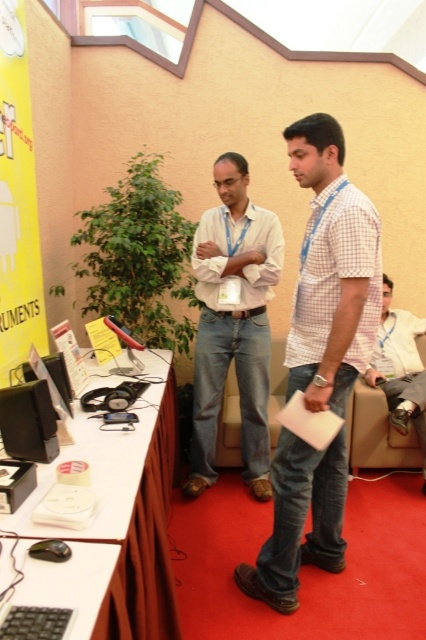
Question: From the image, what is the correct spatial relationship of light beige shirt at center in relation to yellow paper at upper left?

Choices:
 (A) below
 (B) above

Answer: (A)

Question: Which object appears closest to the camera in this image?

Choices:
 (A) yellow paper at upper left
 (B) white glossy table at lower left

Answer: (B)

Question: Is white glossy table at lower left closer to the viewer compared to light beige shirt at center?

Choices:
 (A) yes
 (B) no

Answer: (A)

Question: Based on their relative distances, which object is farther from the white glossy table at lower left?

Choices:
 (A) black plastic keyboard at lower left
 (B) white checkered shirt at center
 (C) yellow paper at upper left

Answer: (C)

Question: Which of the following is the farthest from the observer?

Choices:
 (A) white checkered shirt at center
 (B) yellow paper at upper left
 (C) white glossy table at lower left
 (D) black plastic keyboard at lower left

Answer: (B)

Question: Is white glossy table at lower left below yellow paper at upper left?

Choices:
 (A) yes
 (B) no

Answer: (A)